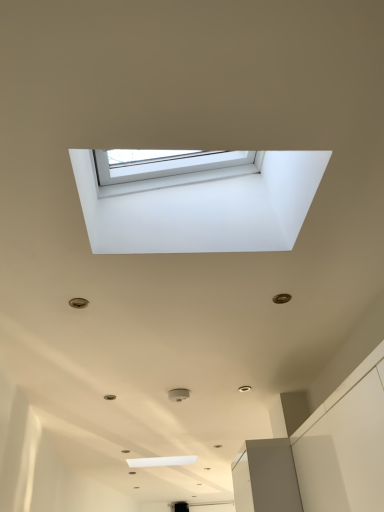
At what (x,y) coordinates should I click in order to perform the action: click on white glossy window at upper center. Please return your answer as a coordinate pair (x, y). Image resolution: width=384 pixels, height=512 pixels. Looking at the image, I should click on (202, 206).

Describe the element at coordinates (202, 206) in the screenshot. I see `white glossy window at upper center` at that location.

What is the approximate height of white glossy window at upper center?

white glossy window at upper center is 17.55 inches tall.

Locate an element on the screen. white glossy window at upper center is located at coordinates (202, 206).